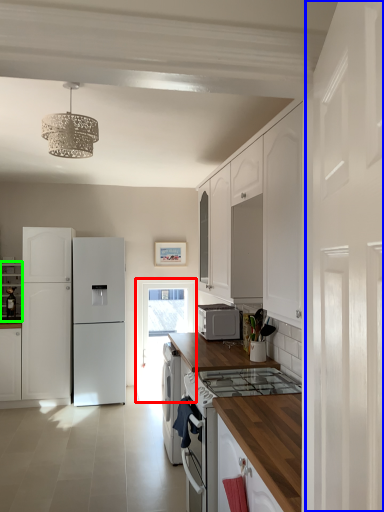
Question: Estimate the real-world distances between objects in this image. Which object is closer to glass door (highlighted by a red box), side (highlighted by a blue box) or cabinetry (highlighted by a green box)?

Choices:
 (A) side
 (B) cabinetry

Answer: (B)